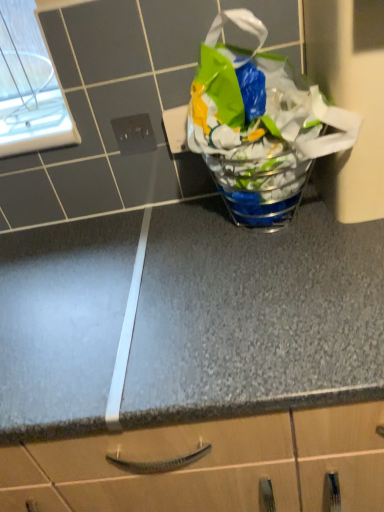
At what (x,y) coordinates should I click in order to perform the action: click on white glossy tile at upper left. Please return your answer as a coordinate pair (x, y). This screenshot has height=512, width=384. Looking at the image, I should click on (79, 132).

Describe the element at coordinates (79, 132) in the screenshot. The height and width of the screenshot is (512, 384). I see `white glossy tile at upper left` at that location.

Identify the location of white glossy tile at upper left. (79, 132).